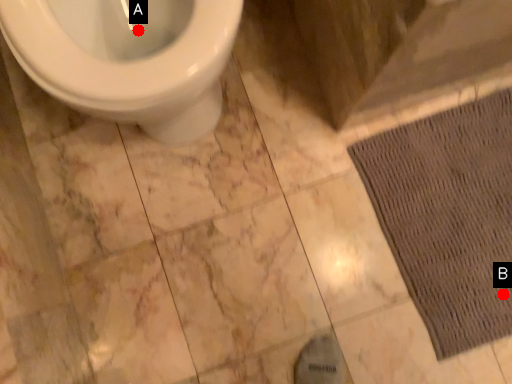
Question: Two points are circled on the image, labeled by A and B beside each circle. Which point appears farthest from the camera in this image?

Choices:
 (A) A is further
 (B) B is further

Answer: (B)